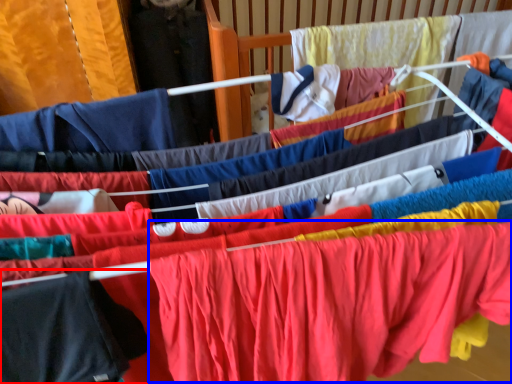
Question: Which point is closer to the camera, clothing (highlighted by a red box) or clothing (highlighted by a blue box)?

Choices:
 (A) clothing
 (B) clothing

Answer: (A)